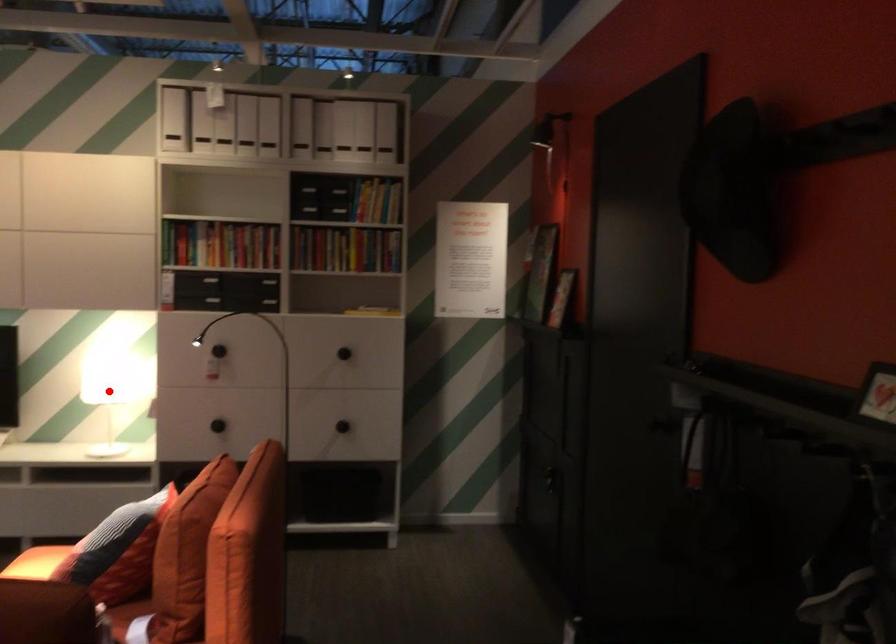
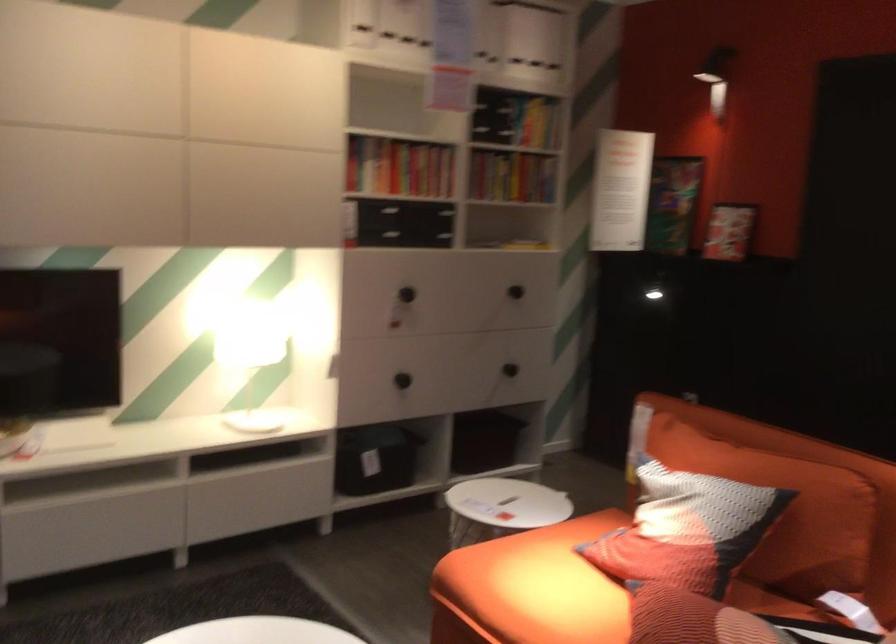
In the second image, find the point that corresponds to the highlighted location in the first image.

(319, 348)